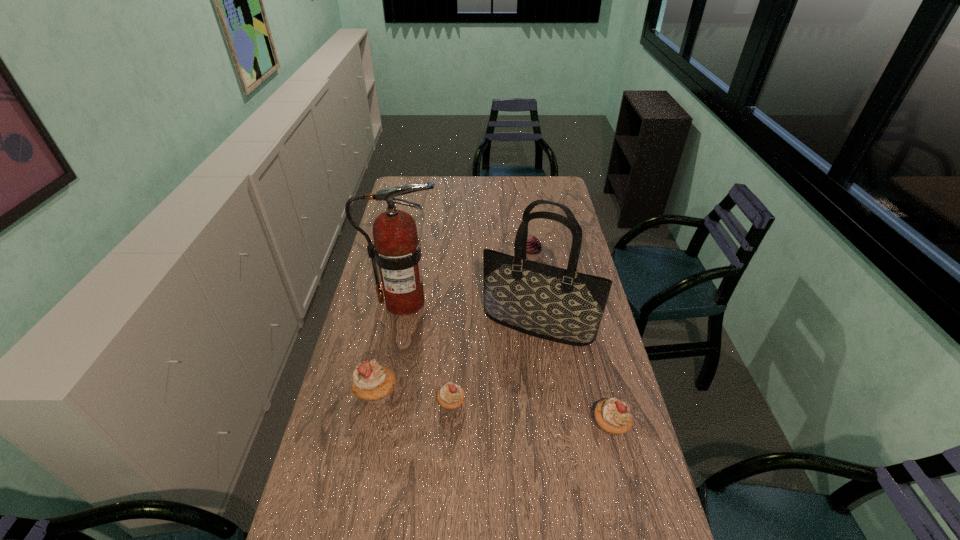
The image size is (960, 540). In order to click on vacant space in between the tote bag and the fire extinguisher in this screenshot , I will do pos(471,314).

Identify the location of free space between the second cupcake from right to left and the fourth object from right to left. Image resolution: width=960 pixels, height=540 pixels. (492, 330).

This screenshot has height=540, width=960. Identify the location of vacant space in between the tallest cupcake and the rightmost cupcake. (493, 409).

Where is `free space between the rightmost cupcake and the tote bag`? free space between the rightmost cupcake and the tote bag is located at coordinates (574, 375).

Locate an element on the screen. The image size is (960, 540). object that stands as the second closest to the rightmost cupcake is located at coordinates (450, 396).

Select which object is the closest to the rightmost cupcake. Please provide its 2D coordinates. Your answer should be formatted as a tuple, i.e. [(x, y)], where the tuple contains the x and y coordinates of a point satisfying the conditions above.

[(561, 305)]

The image size is (960, 540). What are the coordinates of `cupcake that stands as the fourth closest to the fire extinguisher` in the screenshot? It's located at (613, 416).

Locate an element on the screen. The image size is (960, 540). cupcake that is the third closest to the third cupcake from left to right is located at coordinates (372, 382).

Locate an element on the screen. The width and height of the screenshot is (960, 540). free space that satisfies the following two spatial constraints: 1. at the nozzle of the fire extinguisher; 2. on the left side of the rightmost cupcake is located at coordinates (382, 425).

Locate an element on the screen. The height and width of the screenshot is (540, 960). free spot that satisfies the following two spatial constraints: 1. at the nozzle of the fire extinguisher; 2. on the right side of the tote bag is located at coordinates (400, 325).